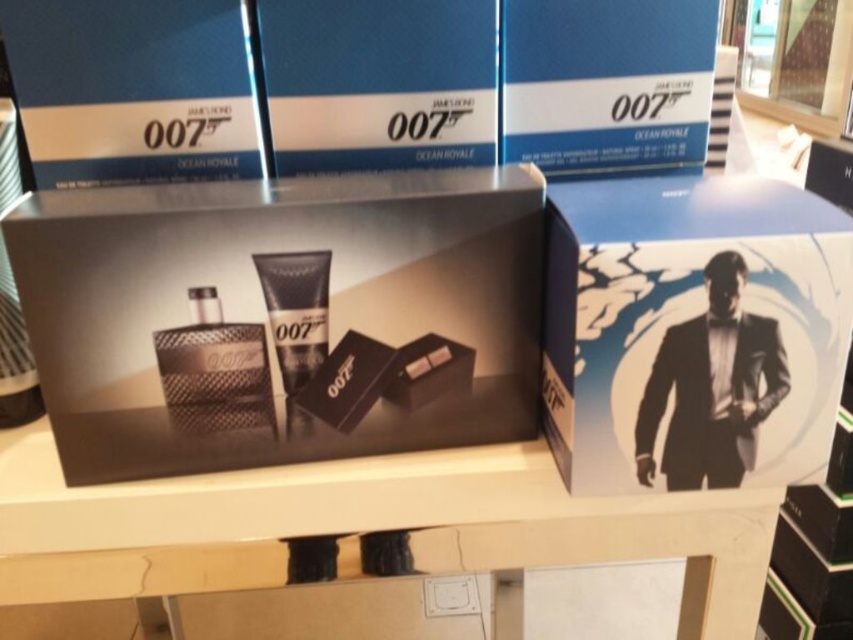
Based on the photo, you are placing a blue cardboard box at upper left on a white glossy table at center. Will the box fit entirely on the table without hanging over the edges?

The white glossy table at center is wider than the blue cardboard box at upper left, so the box will fit entirely on the table without hanging over the edges.

You are a store employee arranging the James Bond 007 Ocean Royale fragrance products. You need to place the matte black box at center and the blue cardboard box at upper center on a shelf. Which box should you place first to ensure stability?

The matte black box at center has a greater height compared to the blue cardboard box at upper center, so you should place the taller matte black box at center first to ensure stability as it can support the shorter blue cardboard box at upper center on top of it.

From the picture: You are a store employee arranging the James Bond 007 Ocean Royale fragrance display. You need to place a label indicating the size comparison between the matte black suit at center and the matte black tube at center. What should the label say?

The label should state that the matte black suit at center is bigger than the matte black tube at center.